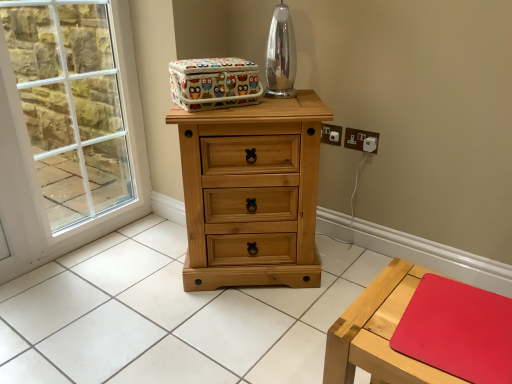
Question: Is white plastic electric outlet at upper right taller or shorter than colorful fabric storage box at upper center?

Choices:
 (A) short
 (B) tall

Answer: (A)

Question: Considering the positions of white plastic electric outlet at upper right and colorful fabric storage box at upper center in the image, is white plastic electric outlet at upper right wider or thinner than colorful fabric storage box at upper center?

Choices:
 (A) wide
 (B) thin

Answer: (B)

Question: Which object is the farthest from the colorful fabric storage box at upper center?

Choices:
 (A) natural wood chest of drawers at center
 (B) white glass window at left
 (C) wooden table at lower right
 (D) white plastic electric outlet at upper right

Answer: (B)

Question: Estimate the real-world distances between objects in this image. Which object is farther from the natural wood chest of drawers at center?

Choices:
 (A) white glass window at left
 (B) colorful fabric storage box at upper center
 (C) white plastic electric outlet at upper right
 (D) wooden table at lower right

Answer: (A)